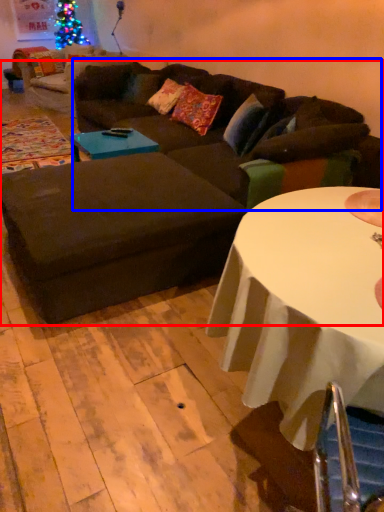
Question: Which point is further to the camera, studio couch (highlighted by a red box) or couch (highlighted by a blue box)?

Choices:
 (A) studio couch
 (B) couch

Answer: (B)